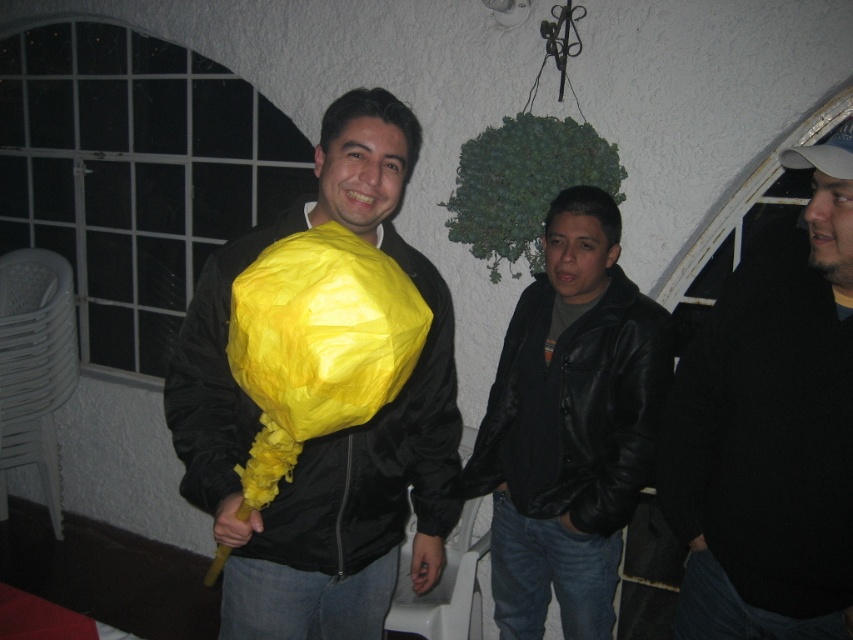
Question: Among these objects, which one is nearest to the camera?

Choices:
 (A) black leather jacket at center
 (B) dark gray knit sweater at right
 (C) matte yellow paper fan at center

Answer: (C)

Question: Does dark gray knit sweater at right appear over black leather jacket at center?

Choices:
 (A) yes
 (B) no

Answer: (A)

Question: Does dark gray knit sweater at right have a lesser width compared to black leather jacket at center?

Choices:
 (A) yes
 (B) no

Answer: (B)

Question: Which of these objects is positioned farthest from the black leather jacket at center?

Choices:
 (A) dark gray knit sweater at right
 (B) matte yellow paper fan at center

Answer: (B)

Question: From the image, what is the correct spatial relationship of matte yellow paper fan at center in relation to black leather jacket at center?

Choices:
 (A) below
 (B) above

Answer: (B)

Question: Which object is positioned closest to the black leather jacket at center?

Choices:
 (A) dark gray knit sweater at right
 (B) matte yellow paper fan at center

Answer: (A)